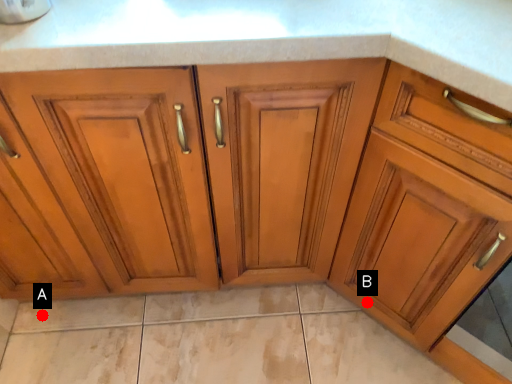
Question: Two points are circled on the image, labeled by A and B beside each circle. Which point is farther from the camera taking this photo?

Choices:
 (A) A is further
 (B) B is further

Answer: (A)